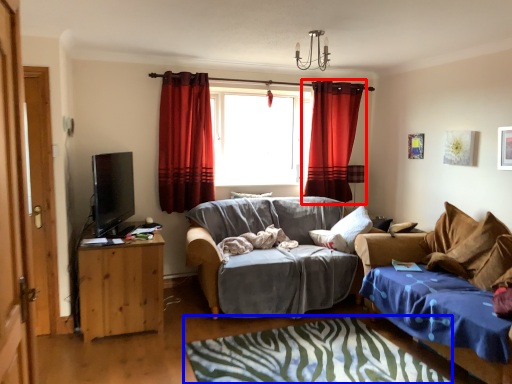
Question: Which point is further to the camera, curtain (highlighted by a red box) or bedcover (highlighted by a blue box)?

Choices:
 (A) curtain
 (B) bedcover

Answer: (A)